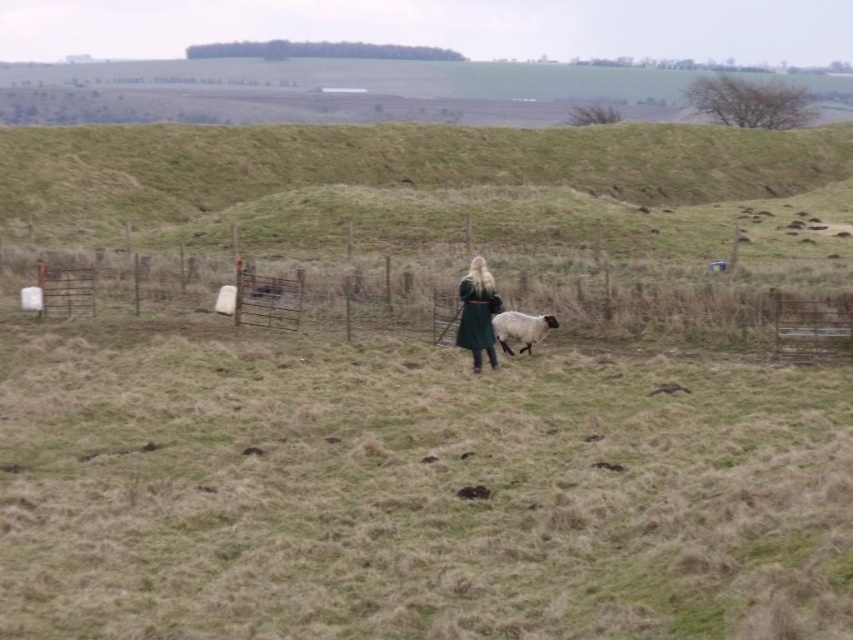
You are a photographer trying to capture a photo of the green woolen coat at center and the white woolly sheep at center. From your current position, which object is located to the left?

The green woolen coat at center is positioned on the left side of the white woolly sheep at center, so the green woolen coat at center is to the left.